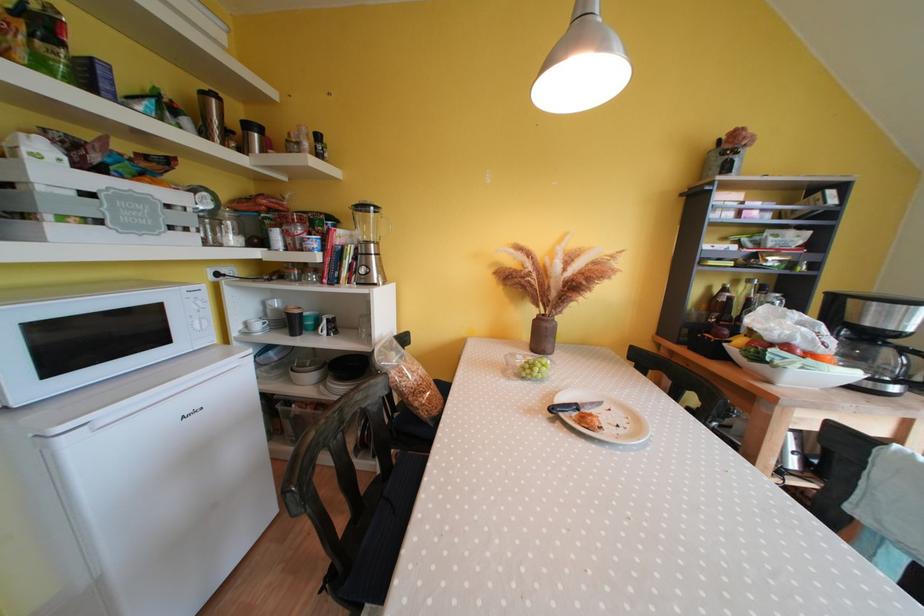
The location [573,407] corresponds to which object?

It refers to a black handle knife.